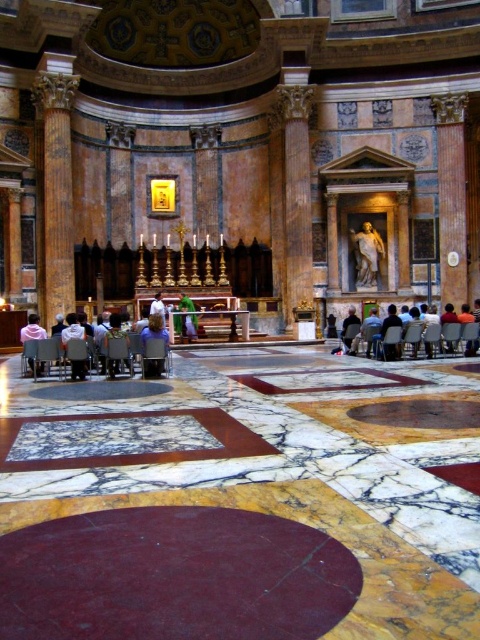
Can you confirm if dark gray fabric chair at lower right is wider than matte gray chair at center?

Yes, dark gray fabric chair at lower right is wider than matte gray chair at center.

Is point (363, 323) closer to viewer compared to point (113, 362)?

No, it is not.

Find the location of a particular element. The height and width of the screenshot is (640, 480). dark gray fabric chair at lower right is located at coordinates (381, 323).

Describe the element at coordinates (127, 326) in the screenshot. The image size is (480, 640). I see `light gray fabric chairs at lower left` at that location.

Between light gray fabric chairs at lower left and white fabric at center, which one is positioned higher?

Positioned higher is white fabric at center.

Who is more distant from viewer, (108, 314) or (165, 323)?

Positioned behind is point (108, 314).

Locate an element on the screen. light gray fabric chairs at lower left is located at coordinates (127, 326).

Is dark gray fabric chair at lower right further to the viewer compared to light pink fabric at lower left?

Yes, dark gray fabric chair at lower right is further from the viewer.

Does point (349, 339) come closer to viewer compared to point (29, 365)?

No, (349, 339) is behind (29, 365).

I want to click on dark gray fabric chair at lower right, so click(381, 323).